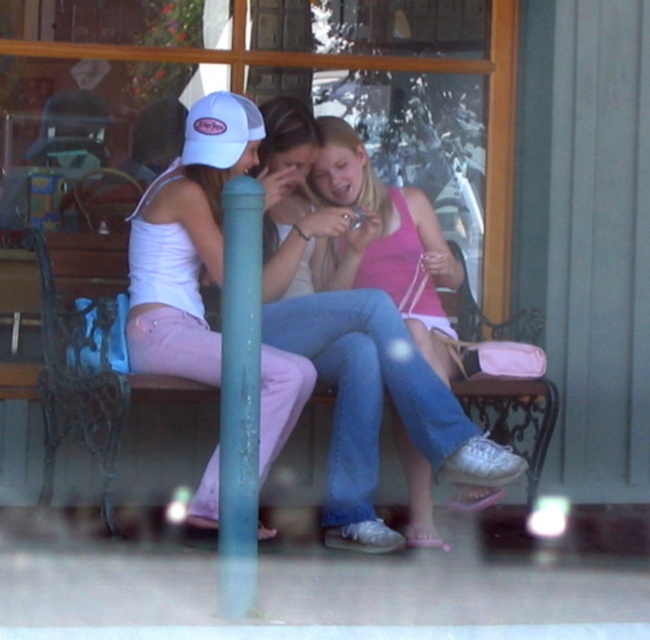
Question: Which point appears farthest from the camera in this image?

Choices:
 (A) (244, 204)
 (B) (195, 278)
 (C) (75, 282)
 (D) (231, 125)

Answer: (C)

Question: Is pink fabric tank top at center positioned behind white matte tank top at left?

Choices:
 (A) no
 (B) yes

Answer: (B)

Question: Considering the relative positions of white matte tank top at left and blue plastic pole at center in the image provided, where is white matte tank top at left located with respect to blue plastic pole at center?

Choices:
 (A) left
 (B) right

Answer: (A)

Question: Can you confirm if pink fabric tank top at center is positioned above blue plastic pole at center?

Choices:
 (A) no
 (B) yes

Answer: (B)

Question: Which point is farther to the camera?

Choices:
 (A) (266, 445)
 (B) (274, 220)
 (C) (254, 257)

Answer: (B)

Question: Which of the following is the farthest from the observer?

Choices:
 (A) (382, 545)
 (B) (52, 289)
 (C) (222, 385)
 (D) (195, 147)

Answer: (B)